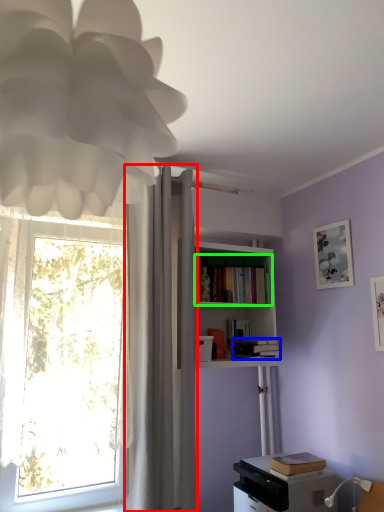
Question: Estimate the real-world distances between objects in this image. Which object is closer to curtain (highlighted by a red box), book (highlighted by a blue box) or book (highlighted by a green box)?

Choices:
 (A) book
 (B) book

Answer: (B)